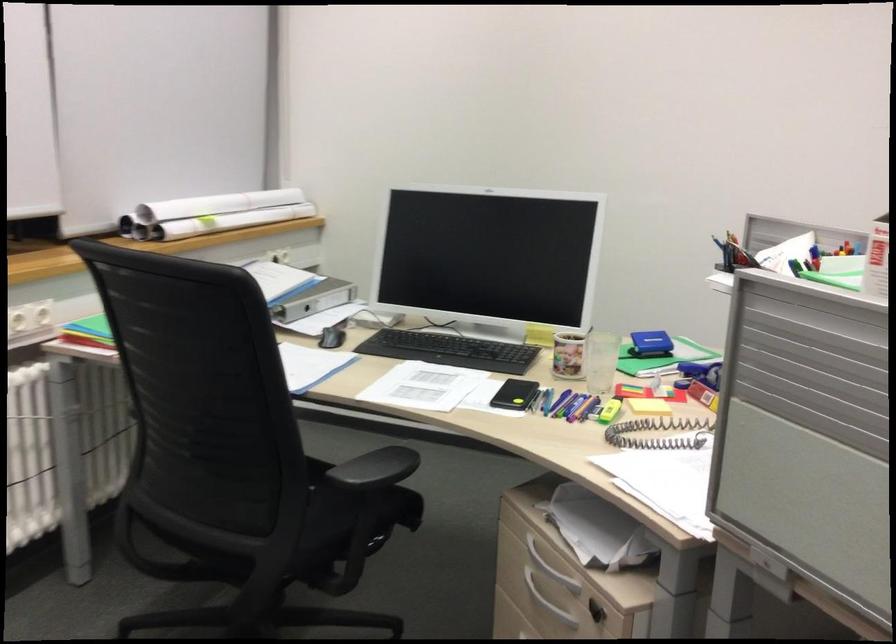
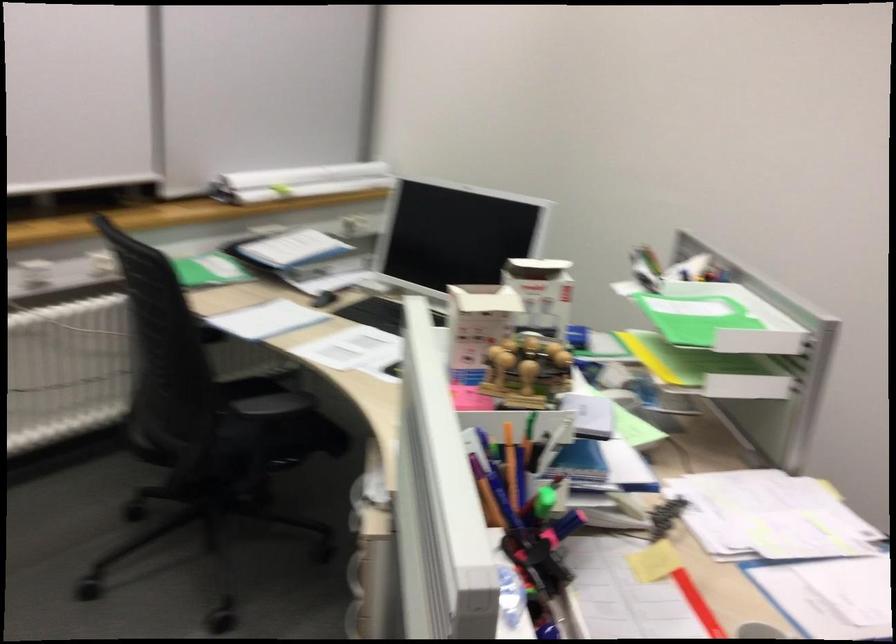
Question: The images are taken continuously from a first-person perspective. In which direction are you moving?

Choices:
 (A) Left
 (B) Right
 (C) Forward
 (D) Backward

Answer: (B)